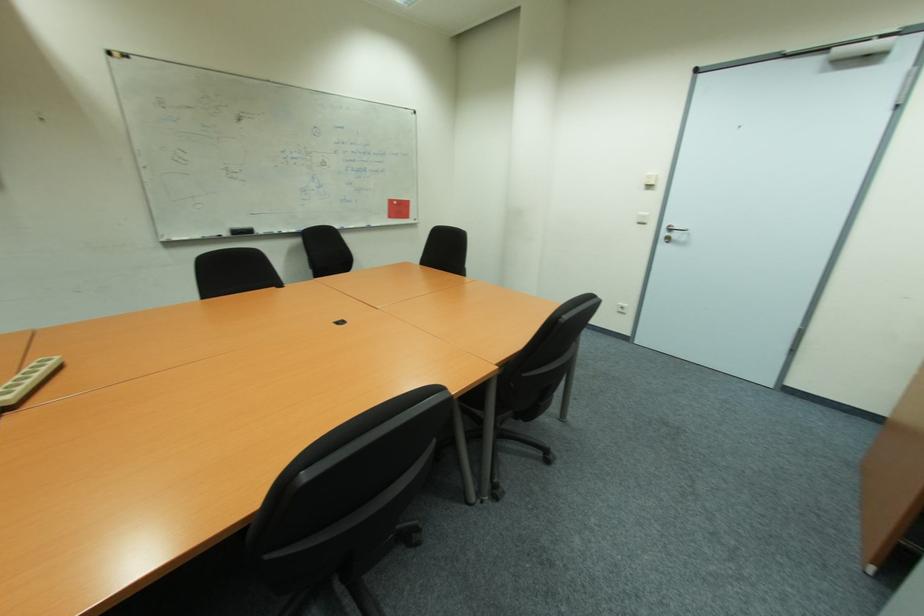
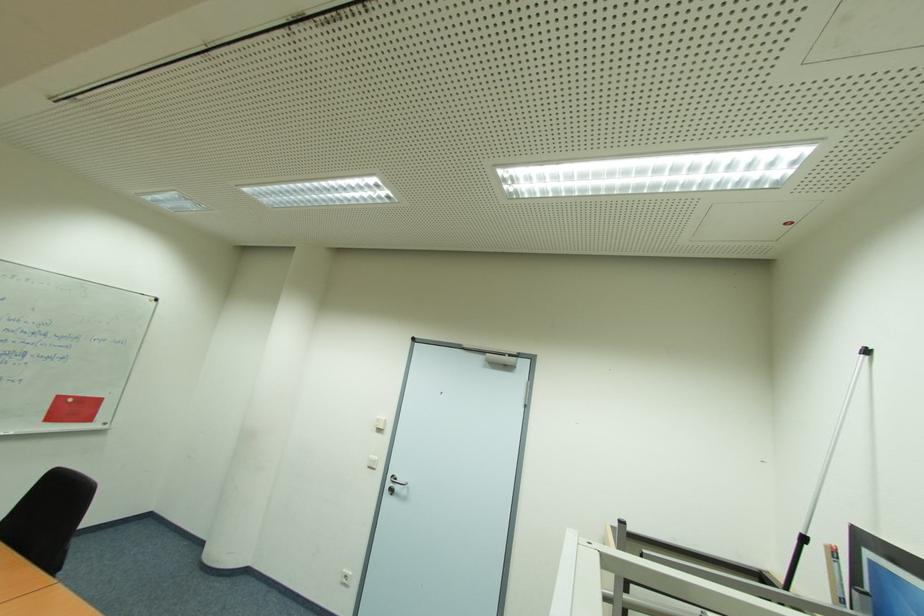
The first image is from the beginning of the video and the second image is from the end. How did the camera likely rotate when shooting the video?

The rotation direction of the camera is right-up.